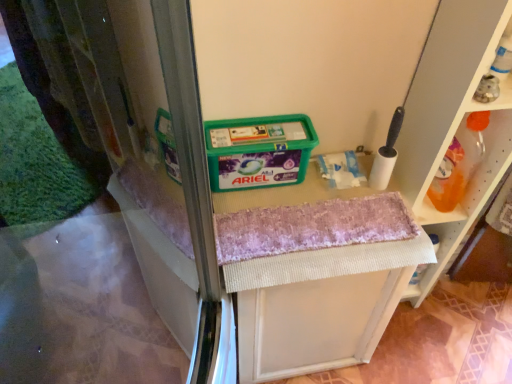
Identify the location of free location in front of white plastic shelf at right, arranged as the 2th shelf when viewed from the back. (410, 346).